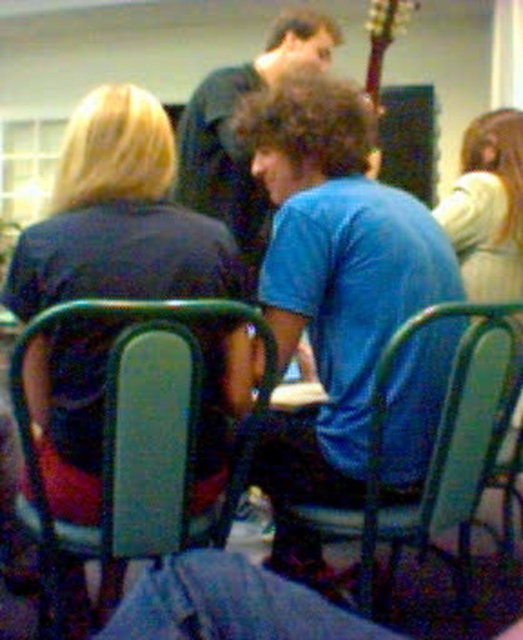
Does blue cotton shirt at center have a lesser height compared to wooden acoustic guitar at upper right?

No, blue cotton shirt at center is not shorter than wooden acoustic guitar at upper right.

Does point (325, 499) come farther from viewer compared to point (372, 76)?

No, (325, 499) is in front of (372, 76).

Who is more forward, (294, 122) or (396, 26)?

Point (294, 122)

Image resolution: width=523 pixels, height=640 pixels. What are the coordinates of `blue cotton shirt at center` in the screenshot? It's located at (333, 273).

Is blue cotton shirt at center positioned before green plastic chair at center?

That is False.

Can you confirm if blue cotton shirt at center is wider than green plastic chair at center?

Incorrect, blue cotton shirt at center's width does not surpass green plastic chair at center's.

The width and height of the screenshot is (523, 640). Describe the element at coordinates (333, 273) in the screenshot. I see `blue cotton shirt at center` at that location.

You are a GUI agent. You are given a task and a screenshot of the screen. Output one action in this format:
    pyautogui.click(x=<x>, y=<y>)
    Task: Click on the blue cotton shirt at center
    This screenshot has width=523, height=640.
    Given the screenshot: What is the action you would take?
    (333, 273)

Between blue cotton shirt at center and dark blue shirt at center, which one has more height?

blue cotton shirt at center

Looking at this image, who is positioned more to the right, blue cotton shirt at center or dark blue shirt at center?

blue cotton shirt at center is more to the right.

Between point (458, 321) and point (265, 221), which one is positioned behind?

Positioned behind is point (265, 221).

The height and width of the screenshot is (640, 523). I want to click on blue cotton shirt at center, so click(333, 273).